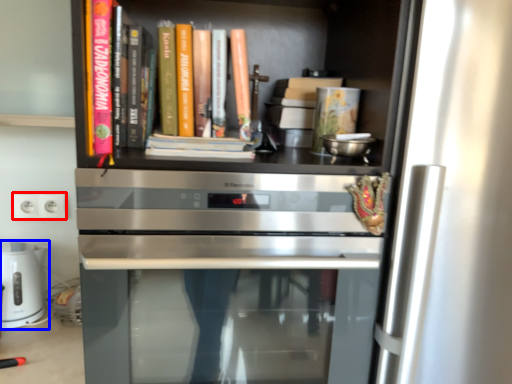
Question: Which of the following is the farthest to the observer, electric outlet (highlighted by a red box) or home appliance (highlighted by a blue box)?

Choices:
 (A) electric outlet
 (B) home appliance

Answer: (A)